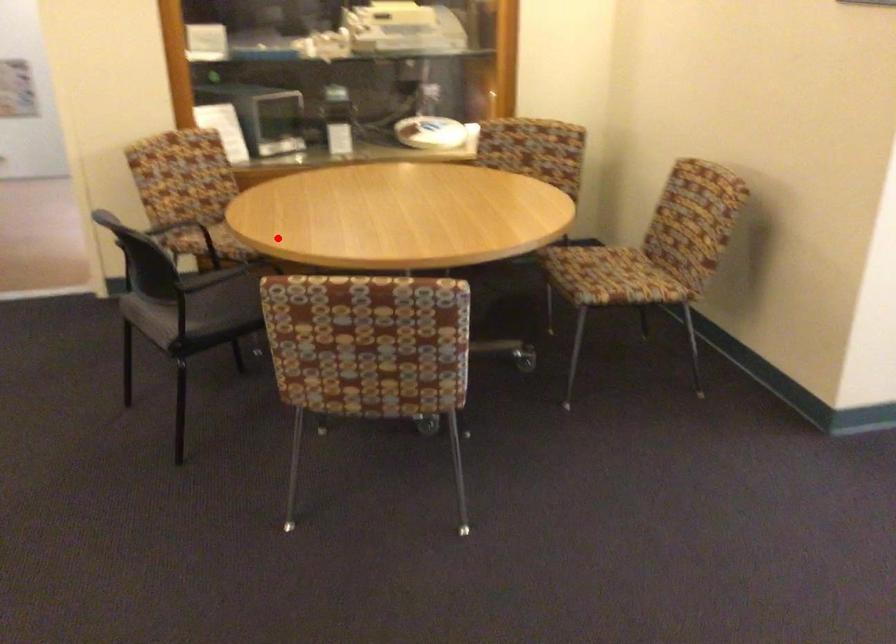
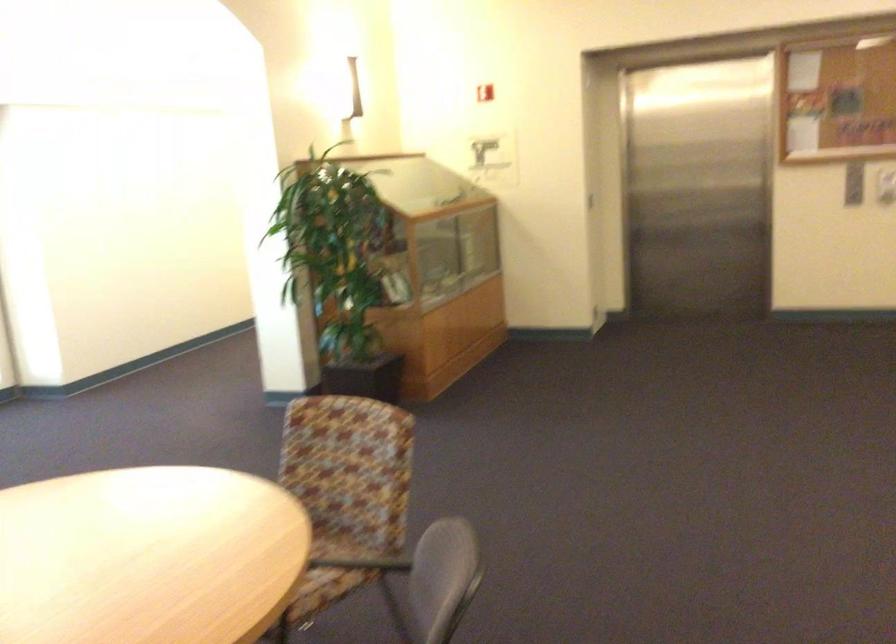
Question: I am providing you with two images of the same scene from different viewpoints. Image1 has a red point marked. In image2, the corresponding 3D location appears at what relative position? Reply with the corresponding letter.

Choices:
 (A) Closer
 (B) Farther

Answer: (A)